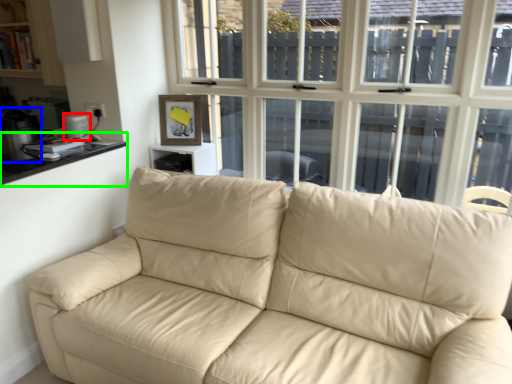
Question: Which object is positioned closest to appliance (highlighted by a red box)? Select from appliance (highlighted by a blue box) and counter top (highlighted by a green box).

Choices:
 (A) appliance
 (B) counter top

Answer: (B)